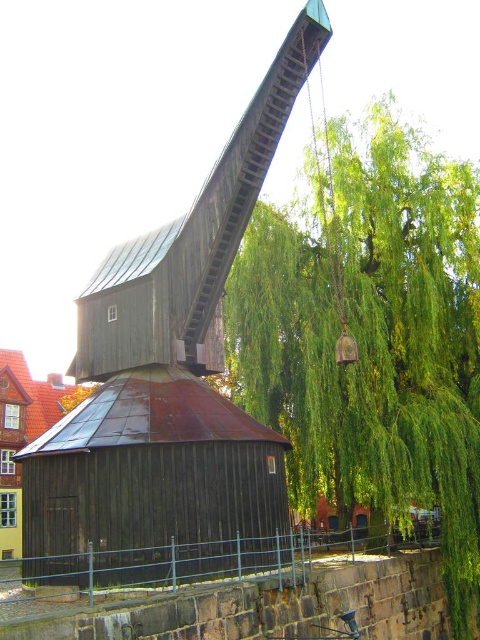
You are standing at the base of the historic wooden crane and want to move towards the riverside. There are two points marked on the ground ahead of you, labeled as point (294, 352) and point (6, 394). Which point is closer to you as you face the crane?

Point (294, 352) is in front of point (6, 394), so it is closer to you when facing the crane.

You are standing on the stone embankment and see the green leafy tree at center and the wooden barn at center. Which one is located to the right side from your perspective?

The green leafy tree at center is located to the right side of the wooden barn at center, so the green leafy tree at center is on the right.

You are standing at the point marked by the coordinates (373, 340) in the image. Based on the scene description, what object are you most likely standing under?

The point marked by the coordinates (373, 340) represents the green leafy tree at center, so you are most likely standing under the green leafy tree at center.